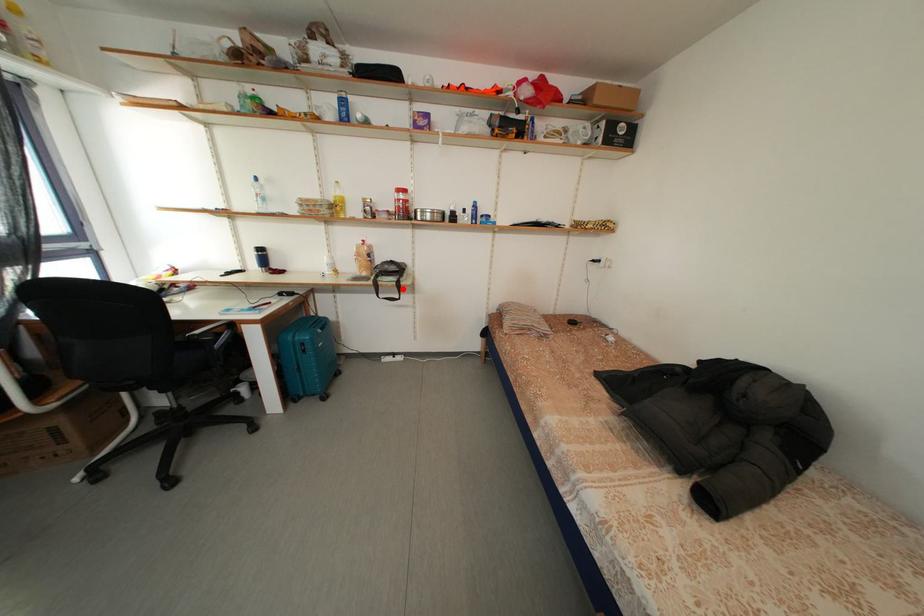
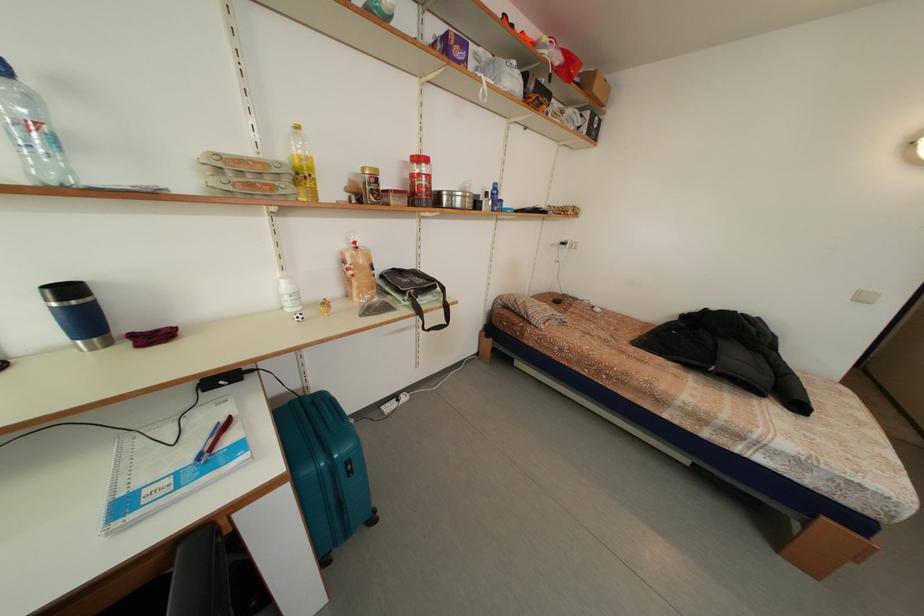
Question: I am providing you with two images of the same scene from different viewpoints. Given a red point in image1, look at the same physical point in image2. Is it:

Choices:
 (A) Closer to the viewpoint
 (B) Farther from the viewpoint

Answer: (B)